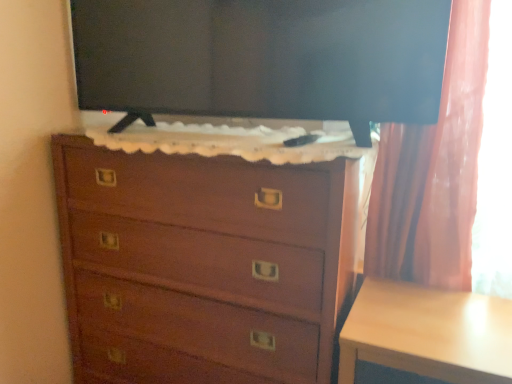
The image size is (512, 384). Identify the location of free space above light wood table at lower right (from a real-world perspective). (444, 318).